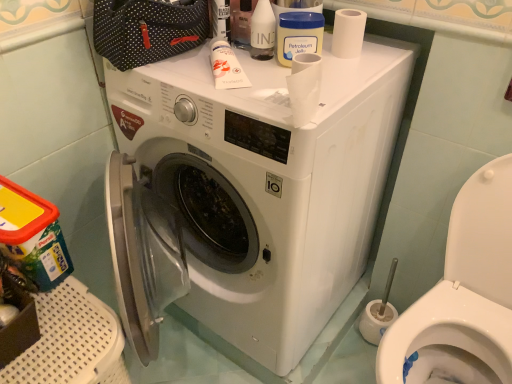
Question: Is white matte tube at upper center, the 1th toiletry ordered from the bottom, surrounded by white glossy toilet at lower right?

Choices:
 (A) no
 (B) yes

Answer: (A)

Question: From a real-world perspective, is white glossy toilet at lower right beneath white matte tube at upper center, which is the 2th toiletry from right to left?

Choices:
 (A) yes
 (B) no

Answer: (A)

Question: Does white glossy toilet at lower right touch white matte tube at upper center, which is the first toiletry from left to right?

Choices:
 (A) no
 (B) yes

Answer: (A)

Question: Could you tell me if white glossy toilet at lower right is turned towards white matte tube at upper center, the 2th toiletry when ordered from top to bottom?

Choices:
 (A) yes
 (B) no

Answer: (B)

Question: From a real-world perspective, is white glossy toilet at lower right on top of white matte tube at upper center, which is the first toiletry from left to right?

Choices:
 (A) no
 (B) yes

Answer: (A)

Question: Is white glossy toilet at lower right positioned before white matte tube at upper center, the 1th toiletry ordered from the bottom?

Choices:
 (A) yes
 (B) no

Answer: (A)

Question: Does white glossy toilet at lower right turn towards white matte toilet paper at upper right?

Choices:
 (A) no
 (B) yes

Answer: (A)

Question: Does white glossy toilet at lower right have a lesser width compared to white matte toilet paper at upper right?

Choices:
 (A) yes
 (B) no

Answer: (B)

Question: From a real-world perspective, is white glossy toilet at lower right on top of white matte toilet paper at upper right?

Choices:
 (A) yes
 (B) no

Answer: (B)

Question: Is white glossy toilet at lower right at the left side of white matte toilet paper at upper right?

Choices:
 (A) yes
 (B) no

Answer: (B)

Question: From the image's perspective, would you say white glossy toilet at lower right is positioned over white matte toilet paper at upper right?

Choices:
 (A) yes
 (B) no

Answer: (B)

Question: Can you confirm if white glossy toilet at lower right is smaller than white matte toilet paper at upper right?

Choices:
 (A) yes
 (B) no

Answer: (B)

Question: Is translucent plastic bottle at upper center, acting as the second toiletry starting from the left, further to camera compared to white matte toilet paper at upper right?

Choices:
 (A) yes
 (B) no

Answer: (B)